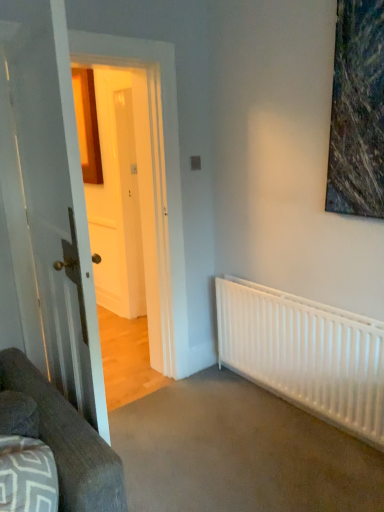
Question: From the image's perspective, is white glossy door at left on white matte radiator at lower right?

Choices:
 (A) yes
 (B) no

Answer: (A)

Question: Would you say white glossy door at left contains white matte radiator at lower right?

Choices:
 (A) yes
 (B) no

Answer: (B)

Question: Is white glossy door at left positioned in front of white matte radiator at lower right?

Choices:
 (A) no
 (B) yes

Answer: (B)

Question: Does white glossy door at left have a lesser height compared to white matte radiator at lower right?

Choices:
 (A) yes
 (B) no

Answer: (B)

Question: Considering the relative sizes of white glossy door at left and white matte radiator at lower right in the image provided, is white glossy door at left wider than white matte radiator at lower right?

Choices:
 (A) yes
 (B) no

Answer: (A)

Question: Is white glossy door at left far away from white matte radiator at lower right?

Choices:
 (A) yes
 (B) no

Answer: (A)

Question: Considering the relative sizes of white matte radiator at lower right and white glossy door at left in the image provided, is white matte radiator at lower right shorter than white glossy door at left?

Choices:
 (A) no
 (B) yes

Answer: (B)

Question: Can you confirm if white matte radiator at lower right is thinner than white glossy door at left?

Choices:
 (A) yes
 (B) no

Answer: (A)

Question: From the image's perspective, is white matte radiator at lower right over white glossy door at left?

Choices:
 (A) yes
 (B) no

Answer: (B)

Question: Can you confirm if white matte radiator at lower right is bigger than white glossy door at left?

Choices:
 (A) yes
 (B) no

Answer: (B)

Question: Is white matte radiator at lower right directly adjacent to white glossy door at left?

Choices:
 (A) no
 (B) yes

Answer: (A)

Question: Is white matte radiator at lower right not near white glossy door at left?

Choices:
 (A) yes
 (B) no

Answer: (A)

Question: Is dark gray fabric couch at lower left looking in the opposite direction of white matte radiator at lower right?

Choices:
 (A) yes
 (B) no

Answer: (B)